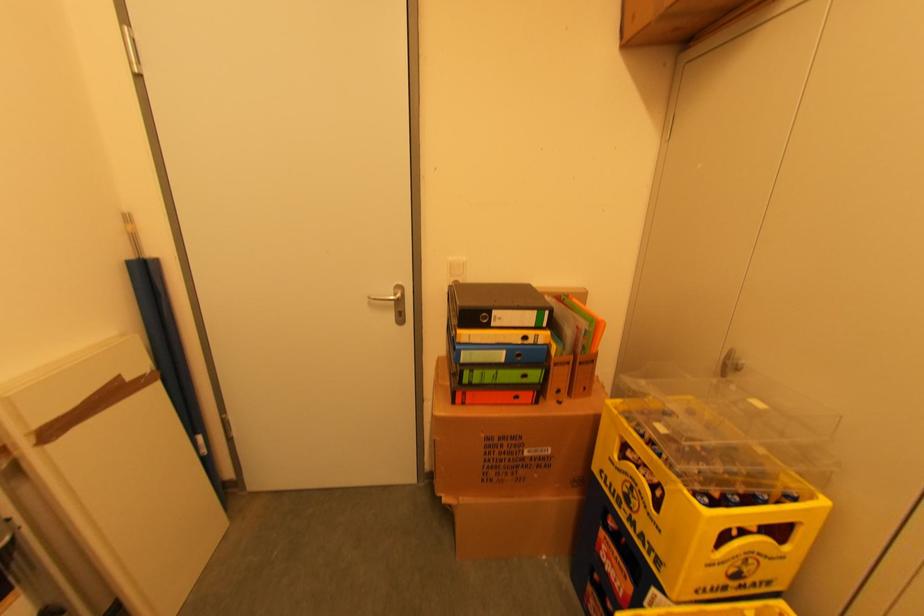
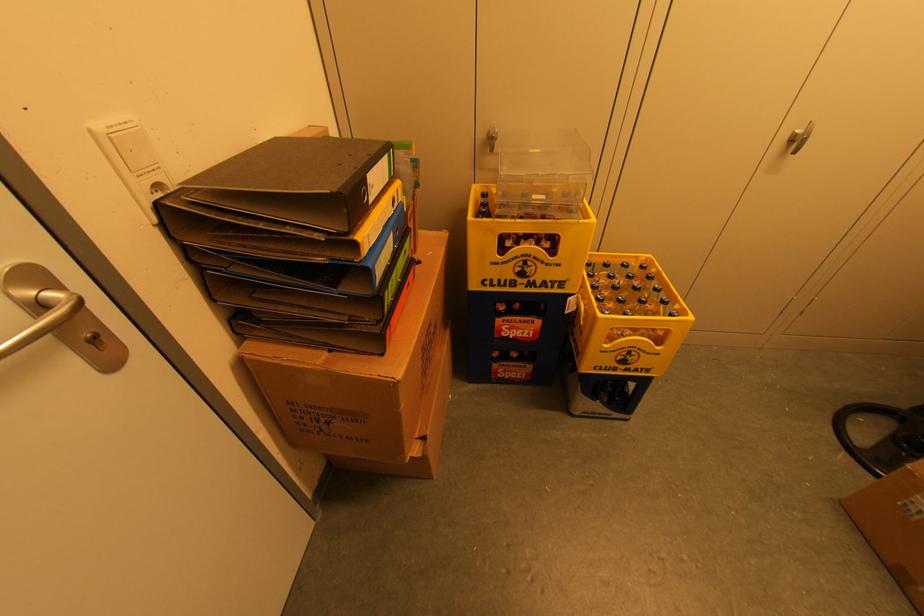
Find the pixel in the second image that matches the point at 636,500 in the first image.

(530, 270)